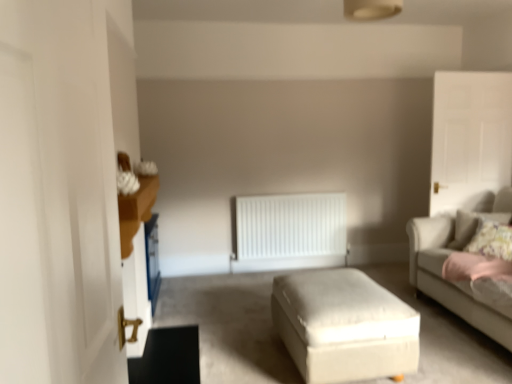
Question: Should I look upward or downward to see white glossy door at left, positioned as the first glass door in front-to-back order?

Choices:
 (A) up
 (B) down

Answer: (B)

Question: From the image's perspective, is white glossy door at left, acting as the 2th glass door starting from the right, above white glossy door at upper right, acting as the 2th glass door starting from the front?

Choices:
 (A) no
 (B) yes

Answer: (A)

Question: From a real-world perspective, is white glossy door at left, arranged as the second glass door when viewed from the back, beneath white glossy door at upper right, the first glass door from the back?

Choices:
 (A) no
 (B) yes

Answer: (B)

Question: From a real-world perspective, is white glossy door at left, arranged as the second glass door when viewed from the back, on white glossy door at upper right, marked as the 1th glass door in a right-to-left arrangement?

Choices:
 (A) yes
 (B) no

Answer: (B)

Question: Is white glossy door at left, arranged as the second glass door when viewed from the back, taller than white glossy door at upper right, the first glass door from the back?

Choices:
 (A) yes
 (B) no

Answer: (B)

Question: Can you confirm if white glossy door at left, arranged as the second glass door when viewed from the back, is shorter than white glossy door at upper right, marked as the 1th glass door in a right-to-left arrangement?

Choices:
 (A) yes
 (B) no

Answer: (A)

Question: Does white glossy door at left, positioned as the first glass door in front-to-back order, appear on the left side of white glossy door at upper right, acting as the 2th glass door starting from the left?

Choices:
 (A) no
 (B) yes

Answer: (B)

Question: Is white matte radiator at center positioned beyond the bounds of white fabric ottoman at center?

Choices:
 (A) yes
 (B) no

Answer: (A)

Question: Does white matte radiator at center have a greater height compared to white fabric ottoman at center?

Choices:
 (A) no
 (B) yes

Answer: (B)

Question: Does white matte radiator at center have a lesser width compared to white fabric ottoman at center?

Choices:
 (A) yes
 (B) no

Answer: (A)

Question: Can you confirm if white matte radiator at center is wider than white fabric ottoman at center?

Choices:
 (A) no
 (B) yes

Answer: (A)

Question: Is white matte radiator at center smaller than white fabric ottoman at center?

Choices:
 (A) no
 (B) yes

Answer: (B)

Question: From a real-world perspective, is white matte radiator at center positioned under white fabric ottoman at center based on gravity?

Choices:
 (A) yes
 (B) no

Answer: (B)

Question: Is white fabric ottoman at center at the right side of white matte radiator at center?

Choices:
 (A) no
 (B) yes

Answer: (B)